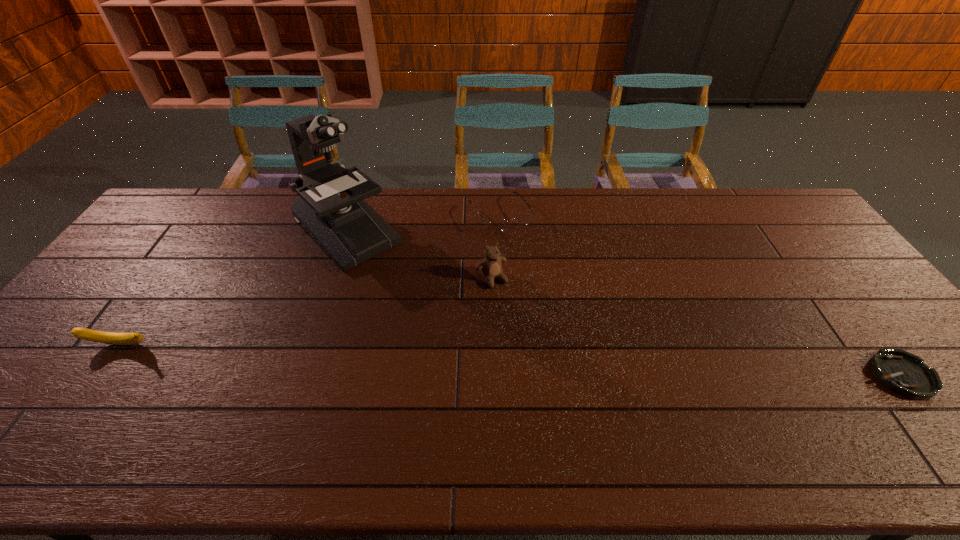
This screenshot has width=960, height=540. I want to click on empty space between the microscope and the second shortest object, so click(x=423, y=224).

The width and height of the screenshot is (960, 540). Identify the location of vacant area that lies between the banana and the fourth shortest object. (305, 312).

In order to click on vacant area that lies between the fourth tallest object and the fourth farthest object in this screenshot , I will do `click(309, 280)`.

The height and width of the screenshot is (540, 960). I want to click on vacant space in between the fourth shortest object and the nearest object, so click(696, 327).

Where is `unoccupied position between the tallest object and the fourth tallest object`? This screenshot has width=960, height=540. unoccupied position between the tallest object and the fourth tallest object is located at coordinates (423, 224).

You are a GUI agent. You are given a task and a screenshot of the screen. Output one action in this format:
    pyautogui.click(x=<x>, y=<y>)
    Task: Click on the vacant area that lies between the spectacles and the microscope
    
    Given the screenshot: What is the action you would take?
    pyautogui.click(x=423, y=224)

At what (x,y) coordinates should I click in order to perform the action: click on empty space that is in between the leftmost object and the second object from left to right. Please return your answer as a coordinate pair (x, y). This screenshot has width=960, height=540. Looking at the image, I should click on (233, 288).

Locate an element on the screen. The width and height of the screenshot is (960, 540). empty space between the ashtray and the banana is located at coordinates (510, 360).

The width and height of the screenshot is (960, 540). In order to click on vacant space in between the teddy bear and the ashtray in this screenshot , I will do `click(696, 327)`.

Locate an element on the screen. free space between the second shortest object and the shortest object is located at coordinates click(700, 295).